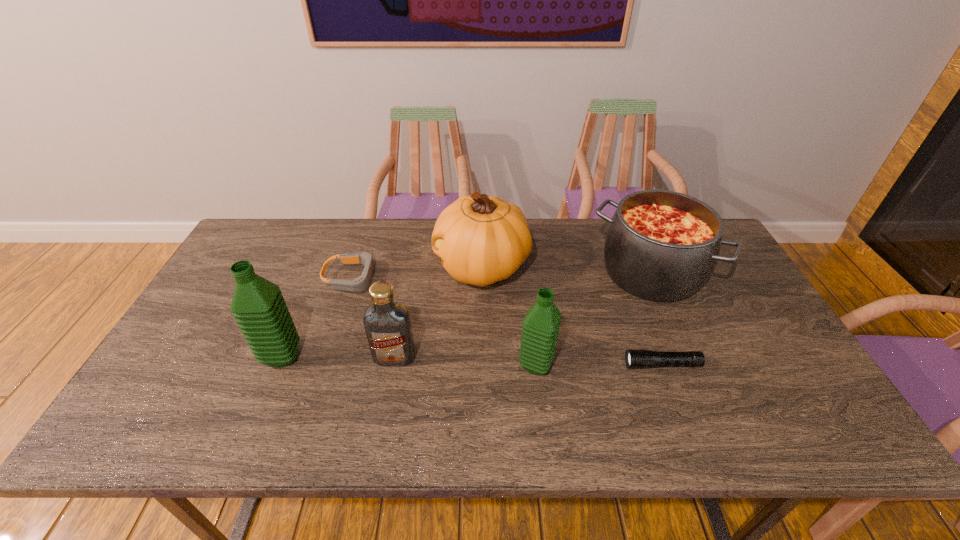
Locate an element on the screen. The height and width of the screenshot is (540, 960). vacant point that satisfies the following two spatial constraints: 1. on the front and back of the right water bottle; 2. on the left side of the goggles is located at coordinates (324, 365).